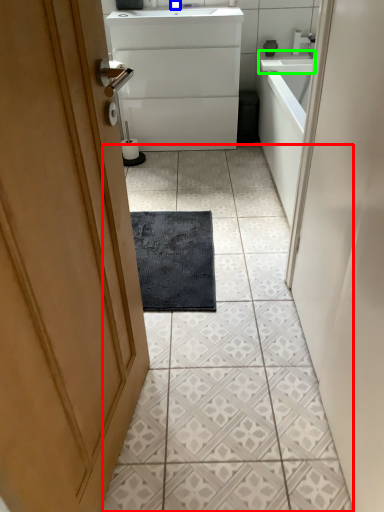
Question: Estimate the real-world distances between objects in this image. Which object is closer to ceramic tile (highlighted by a red box), faucet (highlighted by a blue box) or counter top (highlighted by a green box)?

Choices:
 (A) faucet
 (B) counter top

Answer: (B)